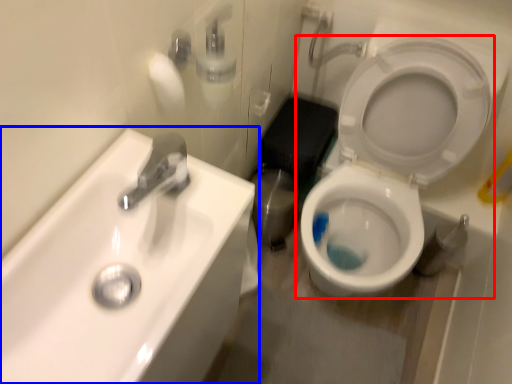
Question: Which of the following is the closest to the observer, toilet (highlighted by a red box) or sink (highlighted by a blue box)?

Choices:
 (A) toilet
 (B) sink

Answer: (B)